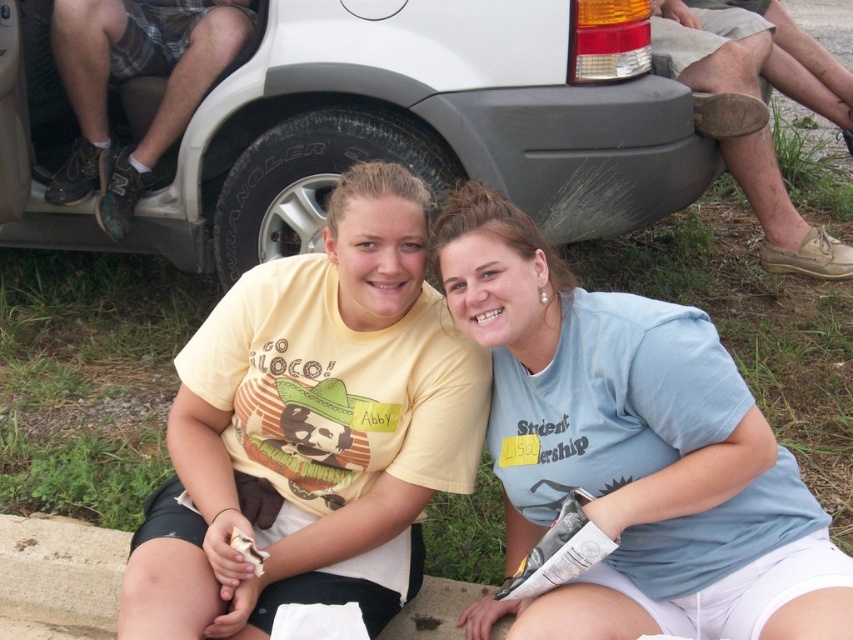
Question: Is black rubber tire at center positioned before brown leather shoe at lower right?

Choices:
 (A) no
 (B) yes

Answer: (B)

Question: Which object appears farthest from the camera in this image?

Choices:
 (A) white matte suv at center
 (B) black rubber tire at center
 (C) brown leather shoe at lower right
 (D) light blue cotton shirt at center

Answer: (C)

Question: Is light blue cotton shirt at center above brown leather shoe at lower right?

Choices:
 (A) no
 (B) yes

Answer: (A)

Question: Can you confirm if white matte suv at center is positioned to the right of light blue cotton shirt at center?

Choices:
 (A) no
 (B) yes

Answer: (A)

Question: Which of the following is the closest to the observer?

Choices:
 (A) white matte suv at center
 (B) black rubber tire at center

Answer: (A)

Question: Estimate the real-world distances between objects in this image. Which object is closer to the white matte suv at center?

Choices:
 (A) brown leather shoe at lower right
 (B) light blue cotton shirt at center
 (C) black rubber tire at center

Answer: (C)